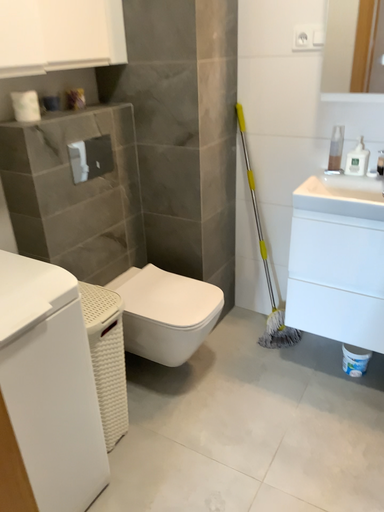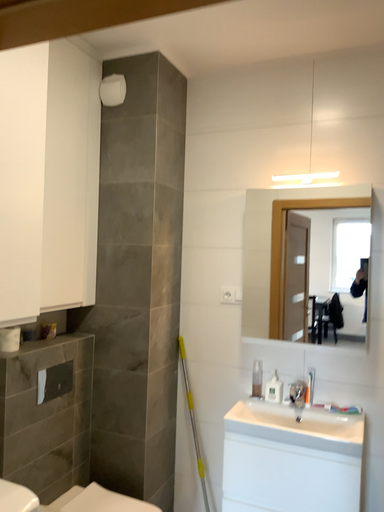
Question: Which way did the camera rotate in the video?

Choices:
 (A) rotated right
 (B) rotated left

Answer: (A)